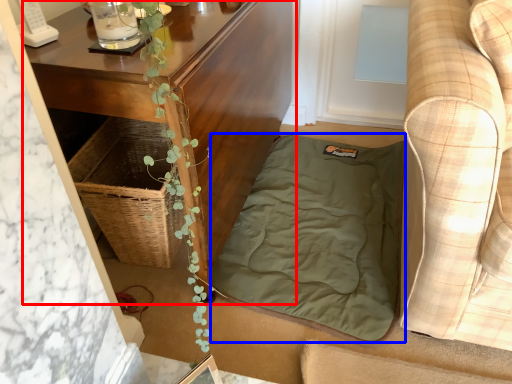
Question: Which of the following is the farthest to the observer, table (highlighted by a red box) or blanket (highlighted by a blue box)?

Choices:
 (A) table
 (B) blanket

Answer: (B)